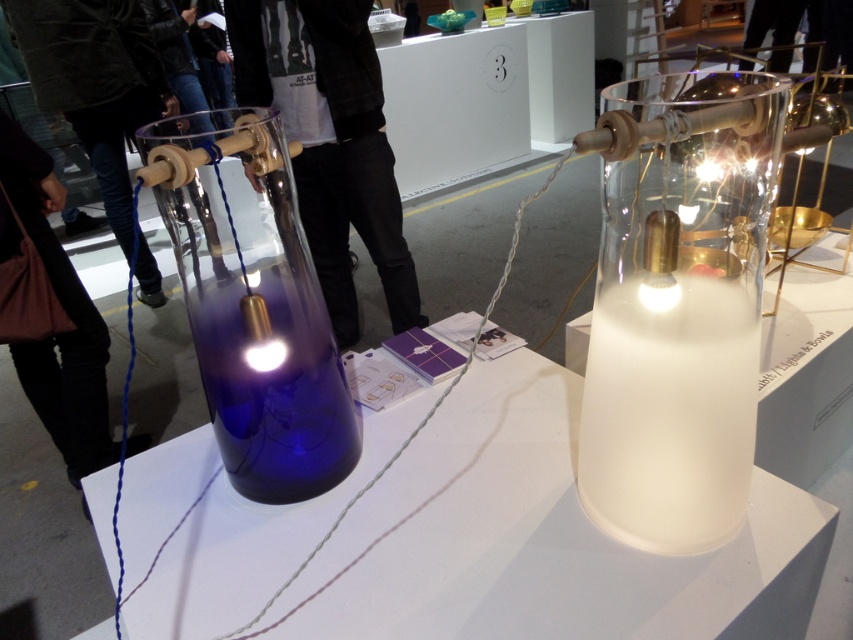
You are an interior designer trying to place the black leather pants at lower left and the translucent white lampshade at center in a narrow hallway. Since the hallway is only 1 meter wide, will both items fit side by side without overlapping?

The black leather pants at lower left is wider than the translucent white lampshade at center. However, since the total width of both items combined exceeds 1 meter, they cannot fit side by side in the hallway without overlapping.

You are an art curator planning to move the satin white glass vase at center and the blue glass vase at left to a new exhibition space. If you want to maintain their original relative positions, which vase should be placed to the right of the other?

The satin white glass vase at center should be placed to the right of the blue glass vase at left to maintain their original relative positions.

You are an art curator planning to move the satin white lamp at center and the satin white glass vase at center to a new exhibition space. The new space has a narrow corridor that only allows moving items one at a time. Based on their positions in the current setup, which item should you move first to maintain the original spatial relationship between them?

You should move the satin white glass vase at center first. Since the satin white lamp at center is to the left of the satin white glass vase at center in the current setup, moving the vase first ensures that when placing the lamp, it can be positioned to the left of the vase, preserving their original spatial arrangement.